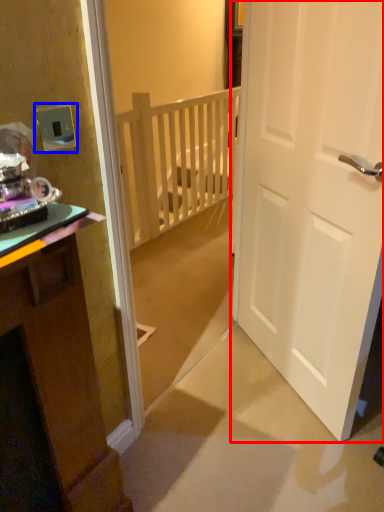
Question: Which point is further to the camera, door (highlighted by a red box) or electric outlet (highlighted by a blue box)?

Choices:
 (A) door
 (B) electric outlet

Answer: (B)